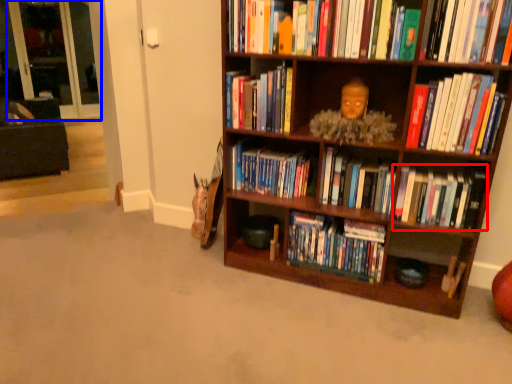
Question: Among these objects, which one is farthest to the camera, book (highlighted by a red box) or glass door (highlighted by a blue box)?

Choices:
 (A) book
 (B) glass door

Answer: (B)